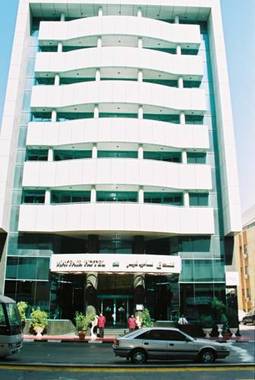
At what (x,y) coordinates should I click in order to perform the action: click on door. Please return your answer as a coordinate pair (x, y). The image size is (255, 380). Looking at the image, I should click on (115, 315).